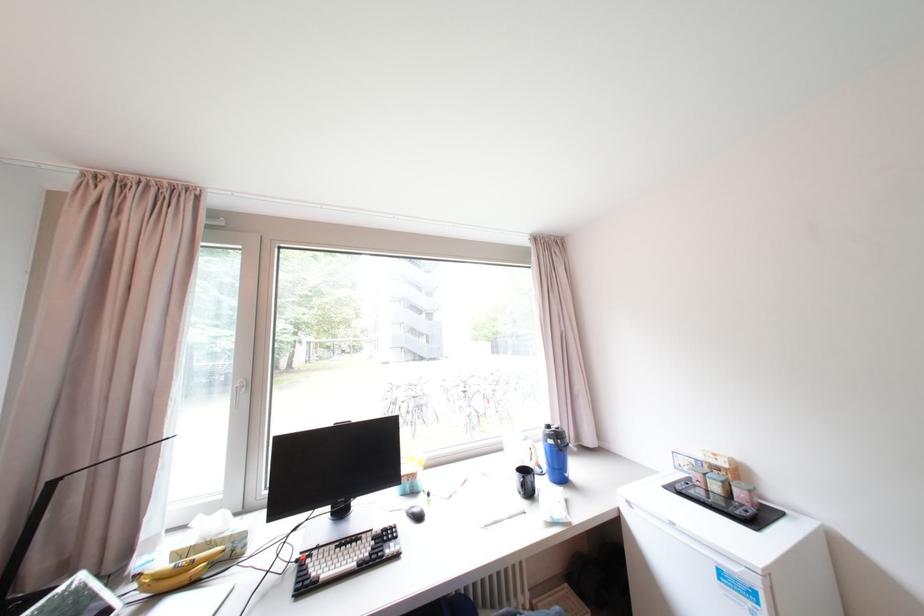
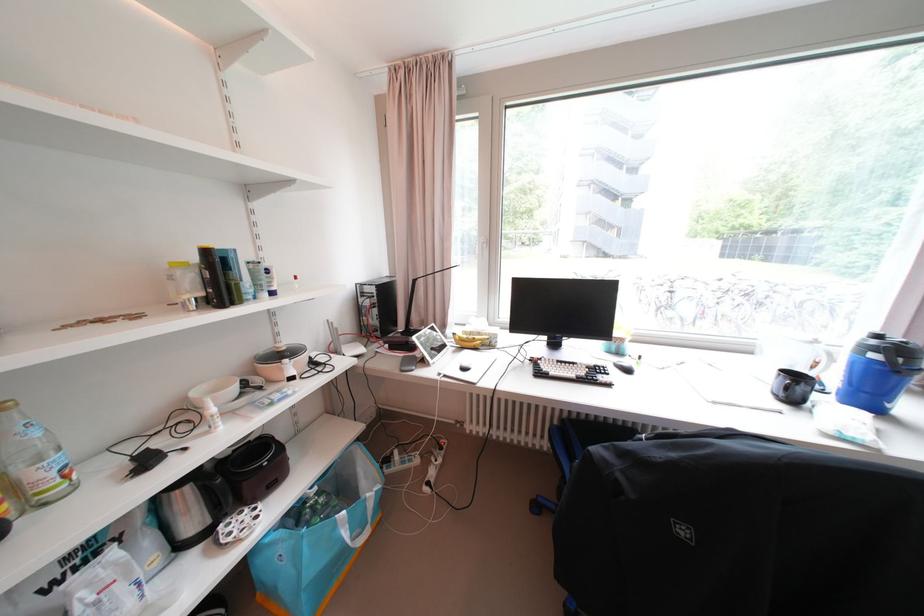
Where in the second image is the point corresponding to point 557,438 from the first image?

(883, 350)